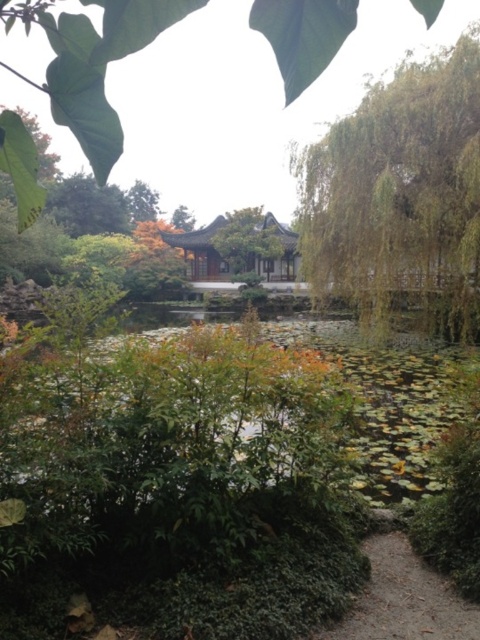
Question: Which of these objects is positioned farthest from the green matte tree at center?

Choices:
 (A) green leafy tree at upper right
 (B) green leafy tree at upper center

Answer: (B)

Question: Which object appears farthest from the camera in this image?

Choices:
 (A) green matte tree at center
 (B) green leafy tree at upper center
 (C) green leafy tree at upper right

Answer: (B)

Question: Does green leafy tree at upper right come in front of green matte tree at center?

Choices:
 (A) no
 (B) yes

Answer: (B)

Question: Estimate the real-world distances between objects in this image. Which object is closer to the green matte tree at center?

Choices:
 (A) green leafy tree at upper center
 (B) green leafy tree at upper right

Answer: (B)

Question: Can you confirm if green matte tree at center is thinner than green leafy tree at upper center?

Choices:
 (A) yes
 (B) no

Answer: (B)

Question: Can you confirm if green matte tree at center is positioned to the right of green leafy tree at upper center?

Choices:
 (A) no
 (B) yes

Answer: (B)